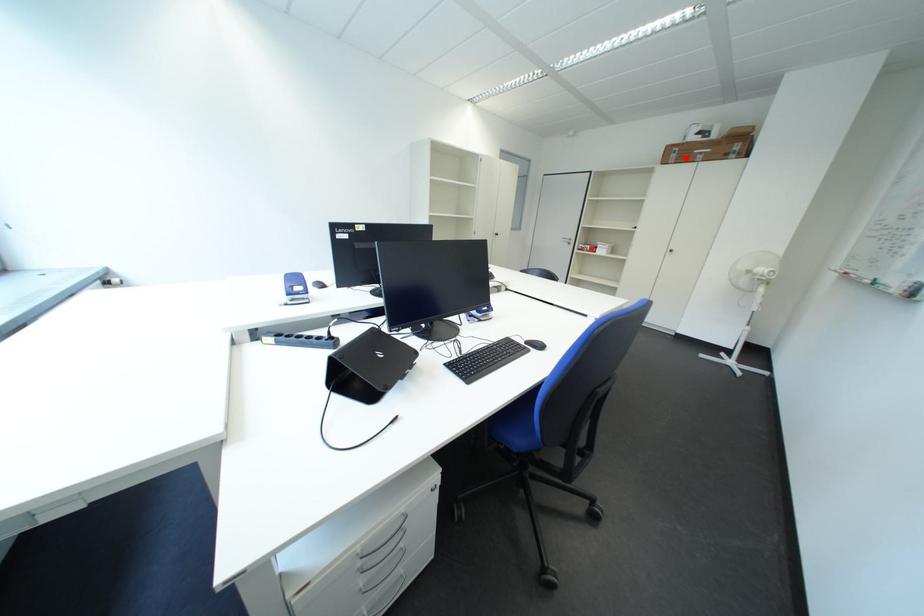
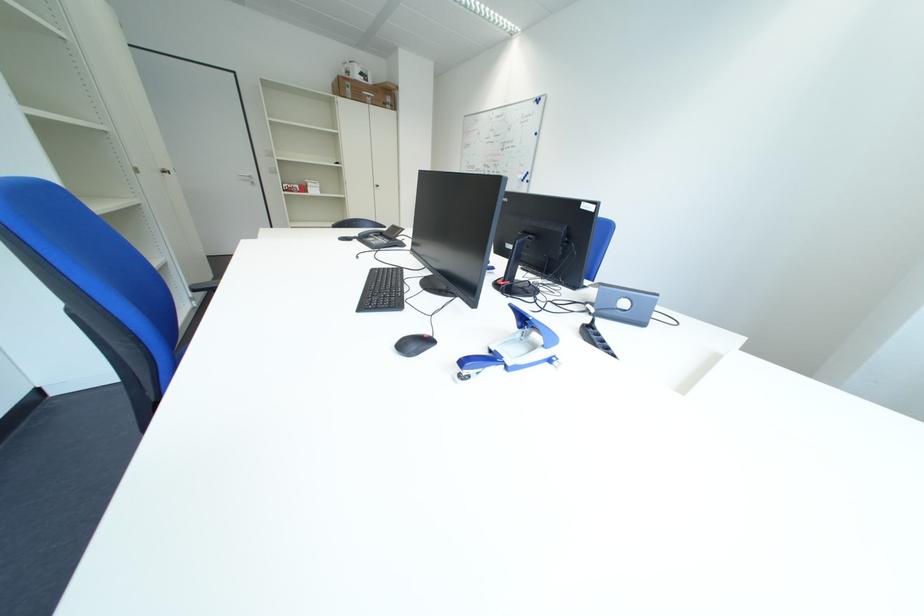
In the second image, find the point that corresponds to the highlighted location in the first image.

(360, 92)